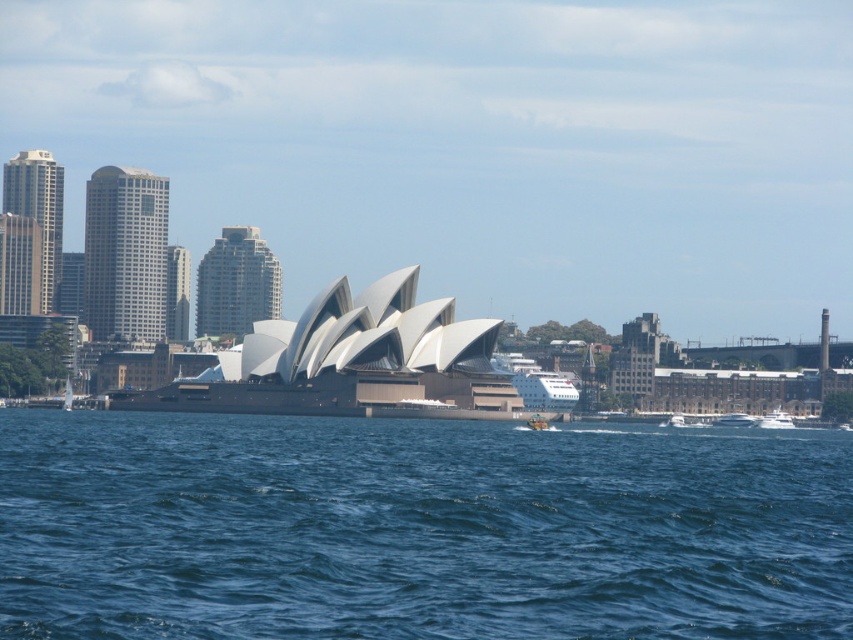
You are a tourist standing at the Sydney Opera House and want to take a photo that includes both the blue water at center and the white matte boat at lower right. Which object should you position closer to the left side of your camera frame?

You should position the blue water at center closer to the left side of your camera frame since it is already on the left side of the white matte boat at lower right in the scene.

You are a tourist standing on the dock near the Sydney Opera House and see the blue water at center and the white glossy boat at lower right. Which object is closer to the dock where you are standing?

The white glossy boat at lower right is closer to the dock where you are standing because it is above the blue water at center.

You are a photographer planning to capture a wide shot of the Sydney Opera House and its surroundings. You have a camera with a standard lens that can capture a maximum width of 10 meters. The blue water at center and the white glossy boat at lower right are both in your frame. Can the camera capture both objects within the frame at the same time?

The blue water at center has a larger width than the white glossy boat at lower right. Since the camera can capture a maximum width of 10 meters, and the blue water at center is wider, it depends on the actual widths. However, the description only states the comparison between their widths, not their exact measurements. Without specific dimensions, it is impossible to definitively determine if both will fit within the 10 meter limit.